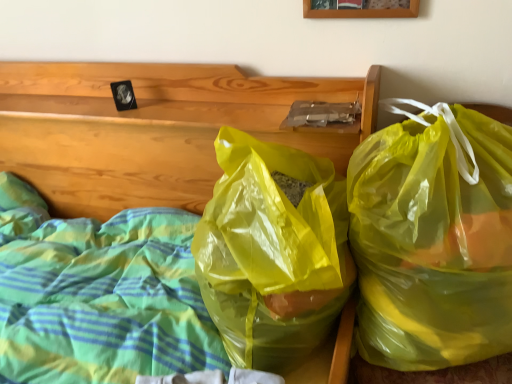
Question: Does yellow translucent bag at right turn towards translucent plastic bags at center?

Choices:
 (A) yes
 (B) no

Answer: (B)

Question: From a real-world perspective, is yellow translucent bag at right below translucent plastic bags at center?

Choices:
 (A) no
 (B) yes

Answer: (B)

Question: Does yellow translucent bag at right have a greater width compared to translucent plastic bags at center?

Choices:
 (A) yes
 (B) no

Answer: (B)

Question: Does yellow translucent bag at right have a greater height compared to translucent plastic bags at center?

Choices:
 (A) no
 (B) yes

Answer: (A)

Question: Is yellow translucent bag at right at the left side of translucent plastic bags at center?

Choices:
 (A) no
 (B) yes

Answer: (A)

Question: Considering the positions of wooden picture frame at upper center and translucent plastic bags at center in the image, is wooden picture frame at upper center bigger or smaller than translucent plastic bags at center?

Choices:
 (A) small
 (B) big

Answer: (A)

Question: Is wooden picture frame at upper center in front of or behind translucent plastic bags at center in the image?

Choices:
 (A) front
 (B) behind

Answer: (B)

Question: Visually, is wooden picture frame at upper center positioned to the left or to the right of translucent plastic bags at center?

Choices:
 (A) left
 (B) right

Answer: (B)

Question: Considering the positions of wooden picture frame at upper center and translucent plastic bags at center in the image, is wooden picture frame at upper center taller or shorter than translucent plastic bags at center?

Choices:
 (A) short
 (B) tall

Answer: (A)

Question: From the image's perspective, relative to yellow translucent bag at right, is wooden picture frame at upper center above or below?

Choices:
 (A) below
 (B) above

Answer: (B)

Question: Considering their positions, is wooden picture frame at upper center located in front of or behind yellow translucent bag at right?

Choices:
 (A) front
 (B) behind

Answer: (B)

Question: From a real-world perspective, relative to yellow translucent bag at right, is wooden picture frame at upper center vertically above or below?

Choices:
 (A) above
 (B) below

Answer: (A)

Question: Based on their positions, is wooden picture frame at upper center located to the left or right of yellow translucent bag at right?

Choices:
 (A) left
 (B) right

Answer: (A)

Question: Would you say translucent plastic bags at center is to the left or to the right of wooden picture frame at upper center in the picture?

Choices:
 (A) right
 (B) left

Answer: (B)

Question: Considering the positions of translucent plastic bags at center and wooden picture frame at upper center in the image, is translucent plastic bags at center bigger or smaller than wooden picture frame at upper center?

Choices:
 (A) small
 (B) big

Answer: (B)